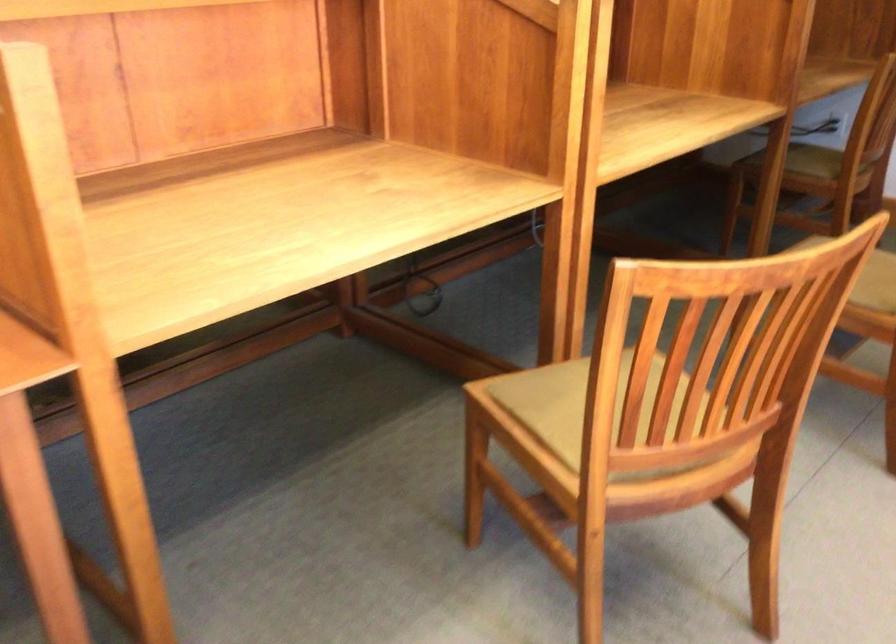
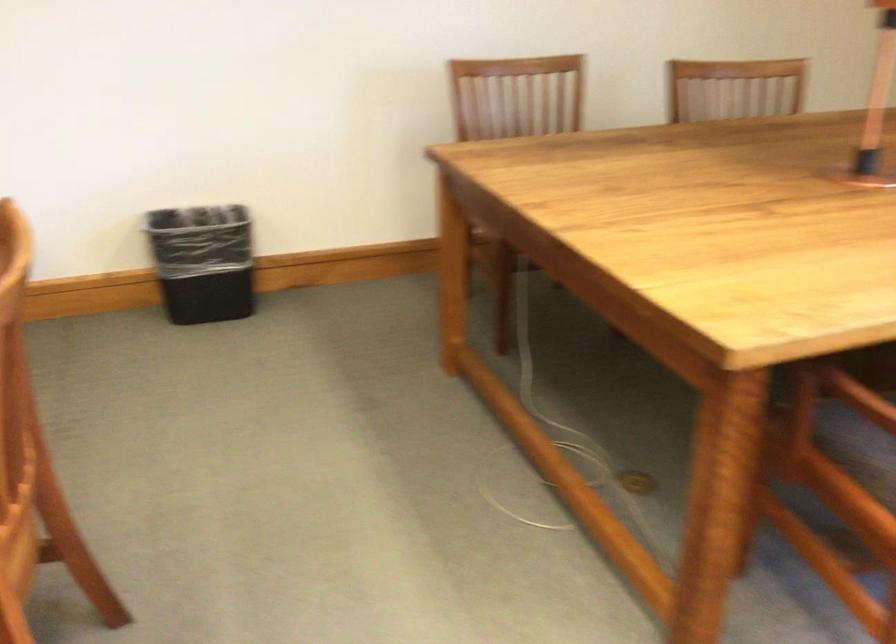
Question: The images are taken continuously from a first-person perspective. In which direction is your viewpoint rotating?

Choices:
 (A) Left
 (B) Right
 (C) Up
 (D) Down

Answer: (B)